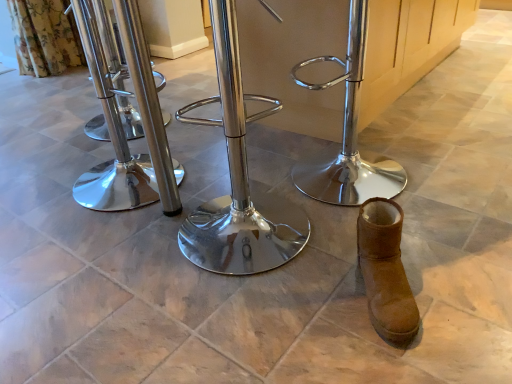
What do you see at coordinates (386, 271) in the screenshot?
I see `brown suede boot at lower right` at bounding box center [386, 271].

What is the approximate height of brown suede boot at lower right?

brown suede boot at lower right is 7.73 inches tall.

What do you see at coordinates (238, 179) in the screenshot? The image size is (512, 384). I see `polished metal swivel chair at center, which is the second swivel chair from right to left` at bounding box center [238, 179].

What is the approximate width of polished metal swivel chair at center, which appears as the 3th swivel chair when viewed from the left?

The width of polished metal swivel chair at center, which appears as the 3th swivel chair when viewed from the left, is 14.79 inches.

What are the coordinates of `polished metal swivel chair at center, marked as the first swivel chair in a left-to-right arrangement` in the screenshot? It's located at (120, 143).

In order to click on brown suede boot at lower right in this screenshot , I will do `click(386, 271)`.

From the image's perspective, is polished metal swivel chair at center, which appears as the 2th swivel chair when viewed from the left, beneath brown suede boot at lower right?

No.

Could you tell me if polished metal swivel chair at center, which appears as the 2th swivel chair when viewed from the left, is facing brown suede boot at lower right?

No.

Is polished metal swivel chair at center, which is the second swivel chair from right to left, next to brown suede boot at lower right and touching it?

No, polished metal swivel chair at center, which is the second swivel chair from right to left, is not with brown suede boot at lower right.

Considering the relative sizes of polished metal swivel chair at center, which is the second swivel chair from right to left, and brown suede boot at lower right in the image provided, is polished metal swivel chair at center, which is the second swivel chair from right to left, thinner than brown suede boot at lower right?

No, polished metal swivel chair at center, which is the second swivel chair from right to left, is not thinner than brown suede boot at lower right.

How many degrees apart are the facing directions of polished metal swivel chair at center, which appears as the 3th swivel chair when viewed from the left, and polished metal swivel chair at center, marked as the 3th swivel chair in a right-to-left arrangement?

There is a 138-degree angle between the facing directions of polished metal swivel chair at center, which appears as the 3th swivel chair when viewed from the left, and polished metal swivel chair at center, marked as the 3th swivel chair in a right-to-left arrangement.

Can polished metal swivel chair at center, marked as the first swivel chair in a left-to-right arrangement, be found inside polished metal swivel chair at center, which appears as the 3th swivel chair when viewed from the left?

No.

Consider the image. In terms of size, does polished metal swivel chair at center, which appears as the 3th swivel chair when viewed from the left, appear bigger or smaller than polished metal swivel chair at center, marked as the first swivel chair in a left-to-right arrangement?

Clearly, polished metal swivel chair at center, which appears as the 3th swivel chair when viewed from the left, is smaller in size than polished metal swivel chair at center, marked as the first swivel chair in a left-to-right arrangement.

Is polished metal swivel chair at center, positioned as the 1th swivel chair in right-to-left order, further to camera compared to polished metal swivel chair at center, marked as the first swivel chair in a left-to-right arrangement?

No, polished metal swivel chair at center, positioned as the 1th swivel chair in right-to-left order, is closer to the viewer.

Is polished metal swivel chair at center, positioned as the 1th swivel chair in right-to-left order, taller than polished metal swivel chair at center, which is the second swivel chair from right to left?

Incorrect, the height of polished metal swivel chair at center, positioned as the 1th swivel chair in right-to-left order, is not larger of that of polished metal swivel chair at center, which is the second swivel chair from right to left.

Is polished metal swivel chair at center, which appears as the 3th swivel chair when viewed from the left, turned away from polished metal swivel chair at center, which is the second swivel chair from right to left?

No, polished metal swivel chair at center, which appears as the 3th swivel chair when viewed from the left, is not facing away from polished metal swivel chair at center, which is the second swivel chair from right to left.

Identify the location of swivel chair that is on the right side of polished metal swivel chair at center, which appears as the 2th swivel chair when viewed from the left. This screenshot has height=384, width=512. (348, 134).

Are polished metal swivel chair at center, positioned as the 1th swivel chair in right-to-left order, and polished metal swivel chair at center, which is the second swivel chair from right to left, far apart?

No.

From the picture: Can you see polished metal swivel chair at center, positioned as the 1th swivel chair in right-to-left order, touching brown suede boot at lower right?

There is a gap between polished metal swivel chair at center, positioned as the 1th swivel chair in right-to-left order, and brown suede boot at lower right.

Can we say polished metal swivel chair at center, which appears as the 3th swivel chair when viewed from the left, lies outside brown suede boot at lower right?

Absolutely, polished metal swivel chair at center, which appears as the 3th swivel chair when viewed from the left, is external to brown suede boot at lower right.

Does point (350, 173) lie behind point (379, 313)?

Yes, it is.

How different are the orientations of polished metal swivel chair at center, positioned as the 1th swivel chair in right-to-left order, and brown suede boot at lower right in degrees?

The angle between the facing direction of polished metal swivel chair at center, positioned as the 1th swivel chair in right-to-left order, and the facing direction of brown suede boot at lower right is 107 degrees.

Between polished metal swivel chair at center, marked as the first swivel chair in a left-to-right arrangement, and polished metal swivel chair at center, positioned as the 1th swivel chair in right-to-left order, which one has less height?

polished metal swivel chair at center, positioned as the 1th swivel chair in right-to-left order, is shorter.

Is polished metal swivel chair at center, marked as the first swivel chair in a left-to-right arrangement, behind polished metal swivel chair at center, which appears as the 3th swivel chair when viewed from the left?

Yes, polished metal swivel chair at center, marked as the first swivel chair in a left-to-right arrangement, is further from the viewer.

Which of these two, polished metal swivel chair at center, marked as the 3th swivel chair in a right-to-left arrangement, or polished metal swivel chair at center, which appears as the 3th swivel chair when viewed from the left, is bigger?

With larger size is polished metal swivel chair at center, marked as the 3th swivel chair in a right-to-left arrangement.

Is polished metal swivel chair at center, marked as the first swivel chair in a left-to-right arrangement, outside of polished metal swivel chair at center, positioned as the 1th swivel chair in right-to-left order?

Yes, polished metal swivel chair at center, marked as the first swivel chair in a left-to-right arrangement, is outside of polished metal swivel chair at center, positioned as the 1th swivel chair in right-to-left order.

Is brown suede boot at lower right positioned in front of polished metal swivel chair at center, positioned as the 1th swivel chair in right-to-left order?

Yes, brown suede boot at lower right is closer to the camera.

Considering the positions of points (384, 293) and (369, 175), is point (384, 293) farther from camera compared to point (369, 175)?

No, it is not.

Considering the sizes of objects brown suede boot at lower right and polished metal swivel chair at center, which appears as the 3th swivel chair when viewed from the left, in the image provided, who is bigger, brown suede boot at lower right or polished metal swivel chair at center, which appears as the 3th swivel chair when viewed from the left,?

polished metal swivel chair at center, which appears as the 3th swivel chair when viewed from the left, is bigger.

Is brown suede boot at lower right far from polished metal swivel chair at center, positioned as the 1th swivel chair in right-to-left order?

No, brown suede boot at lower right is not far away from polished metal swivel chair at center, positioned as the 1th swivel chair in right-to-left order.

Find the location of `footwear that appears on the right of polished metal swivel chair at center, which is the second swivel chair from right to left`. footwear that appears on the right of polished metal swivel chair at center, which is the second swivel chair from right to left is located at coordinates (386, 271).

Is brown suede boot at lower right inside the boundaries of polished metal swivel chair at center, which appears as the 2th swivel chair when viewed from the left, or outside?

The correct answer is: outside.

Consider the image. From a real-world perspective, who is located higher, brown suede boot at lower right or polished metal swivel chair at center, which appears as the 2th swivel chair when viewed from the left?

polished metal swivel chair at center, which appears as the 2th swivel chair when viewed from the left, from a real-world perspective.

Is brown suede boot at lower right bigger or smaller than polished metal swivel chair at center, which appears as the 2th swivel chair when viewed from the left?

In the image, brown suede boot at lower right appears to be smaller than polished metal swivel chair at center, which appears as the 2th swivel chair when viewed from the left.

Image resolution: width=512 pixels, height=384 pixels. There is a brown suede boot at lower right. Find the location of `the 3rd swivel chair above it (from a real-world perspective)`. the 3rd swivel chair above it (from a real-world perspective) is located at coordinates (238, 179).

This screenshot has width=512, height=384. Find the location of `swivel chair that is the 1st object located below the polished metal swivel chair at center, marked as the first swivel chair in a left-to-right arrangement (from the image's perspective)`. swivel chair that is the 1st object located below the polished metal swivel chair at center, marked as the first swivel chair in a left-to-right arrangement (from the image's perspective) is located at coordinates (348, 134).

When comparing their distances from polished metal swivel chair at center, marked as the first swivel chair in a left-to-right arrangement, does polished metal swivel chair at center, which appears as the 2th swivel chair when viewed from the left, or polished metal swivel chair at center, positioned as the 1th swivel chair in right-to-left order, seem further?

Based on the image, polished metal swivel chair at center, positioned as the 1th swivel chair in right-to-left order, appears to be further to polished metal swivel chair at center, marked as the first swivel chair in a left-to-right arrangement.

Considering their positions, is polished metal swivel chair at center, which appears as the 3th swivel chair when viewed from the left, positioned closer to brown suede boot at lower right than polished metal swivel chair at center, marked as the 3th swivel chair in a right-to-left arrangement?

The object closer to brown suede boot at lower right is polished metal swivel chair at center, which appears as the 3th swivel chair when viewed from the left.

Estimate the real-world distances between objects in this image. Which object is further from brown suede boot at lower right, polished metal swivel chair at center, which appears as the 2th swivel chair when viewed from the left, or polished metal swivel chair at center, marked as the 3th swivel chair in a right-to-left arrangement?

polished metal swivel chair at center, marked as the 3th swivel chair in a right-to-left arrangement, is further to brown suede boot at lower right.

Which object lies further to the anchor point polished metal swivel chair at center, marked as the 3th swivel chair in a right-to-left arrangement, brown suede boot at lower right or polished metal swivel chair at center, positioned as the 1th swivel chair in right-to-left order?

The object further to polished metal swivel chair at center, marked as the 3th swivel chair in a right-to-left arrangement, is brown suede boot at lower right.

Considering their positions, is polished metal swivel chair at center, which appears as the 2th swivel chair when viewed from the left, positioned closer to polished metal swivel chair at center, positioned as the 1th swivel chair in right-to-left order, than polished metal swivel chair at center, marked as the 3th swivel chair in a right-to-left arrangement?

polished metal swivel chair at center, which appears as the 2th swivel chair when viewed from the left, is closer to polished metal swivel chair at center, positioned as the 1th swivel chair in right-to-left order.

Looking at the image, which one is located closer to brown suede boot at lower right, polished metal swivel chair at center, which appears as the 2th swivel chair when viewed from the left, or polished metal swivel chair at center, positioned as the 1th swivel chair in right-to-left order?

polished metal swivel chair at center, which appears as the 2th swivel chair when viewed from the left.

Estimate the real-world distances between objects in this image. Which object is further from polished metal swivel chair at center, positioned as the 1th swivel chair in right-to-left order, brown suede boot at lower right or polished metal swivel chair at center, which appears as the 2th swivel chair when viewed from the left?

Based on the image, brown suede boot at lower right appears to be further to polished metal swivel chair at center, positioned as the 1th swivel chair in right-to-left order.

Based on their spatial positions, is brown suede boot at lower right or polished metal swivel chair at center, marked as the first swivel chair in a left-to-right arrangement, closer to polished metal swivel chair at center, positioned as the 1th swivel chair in right-to-left order?

The object closer to polished metal swivel chair at center, positioned as the 1th swivel chair in right-to-left order, is brown suede boot at lower right.

You are a GUI agent. You are given a task and a screenshot of the screen. Output one action in this format:
    pyautogui.click(x=<x>, y=<y>)
    Task: Click on the swivel chair between polished metal swivel chair at center, which appears as the 3th swivel chair when viewed from the left, and brown suede boot at lower right vertically
    This screenshot has width=512, height=384.
    Given the screenshot: What is the action you would take?
    click(x=238, y=179)

The height and width of the screenshot is (384, 512). In order to click on swivel chair located between polished metal swivel chair at center, marked as the 3th swivel chair in a right-to-left arrangement, and brown suede boot at lower right in the left-right direction in this screenshot , I will do `click(238, 179)`.

I want to click on footwear between polished metal swivel chair at center, marked as the first swivel chair in a left-to-right arrangement, and polished metal swivel chair at center, which appears as the 3th swivel chair when viewed from the left, in the horizontal direction, so click(386, 271).

Identify the location of swivel chair located between polished metal swivel chair at center, marked as the 3th swivel chair in a right-to-left arrangement, and polished metal swivel chair at center, positioned as the 1th swivel chair in right-to-left order, in the left-right direction. This screenshot has width=512, height=384. (238, 179).